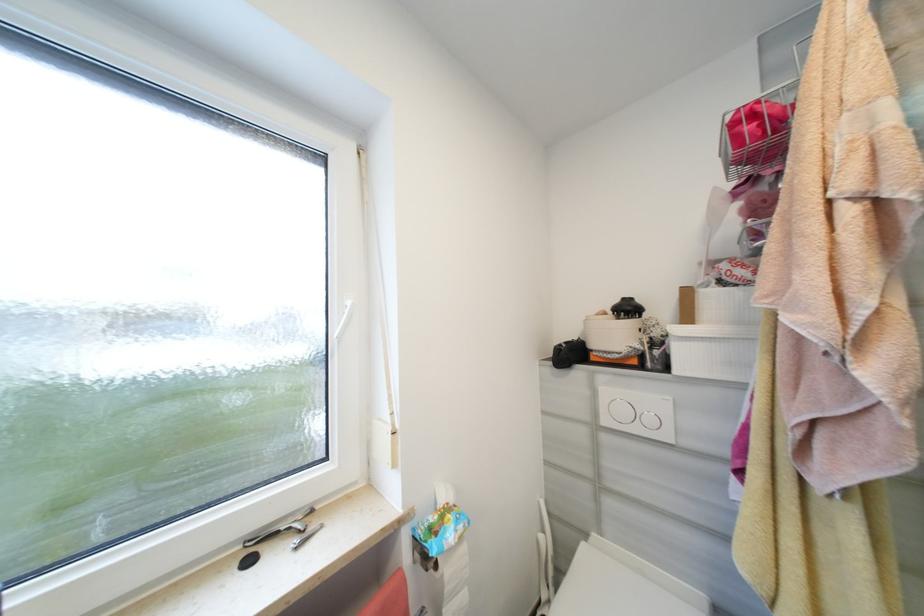
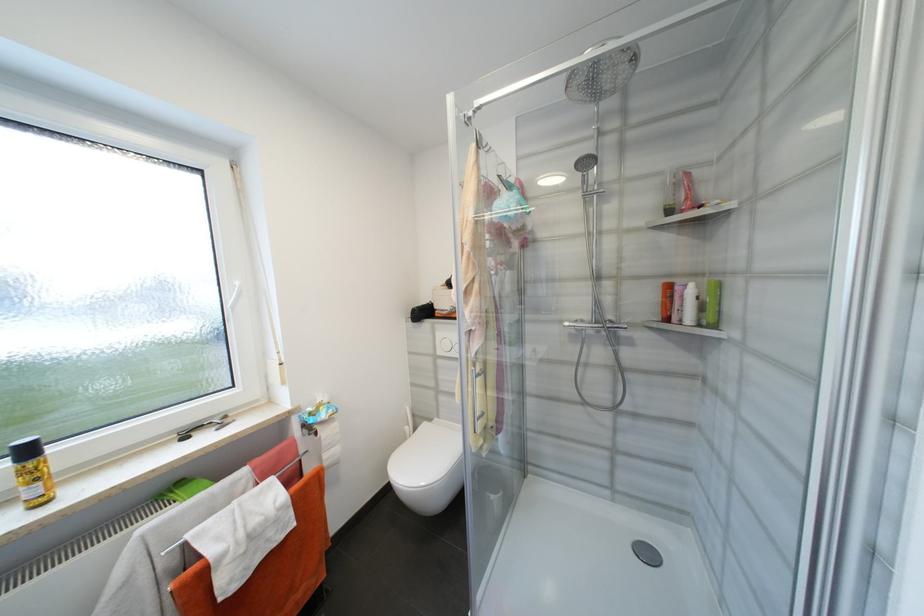
Find the pixel in the second image that matches point 442,567 in the first image.

(322, 435)